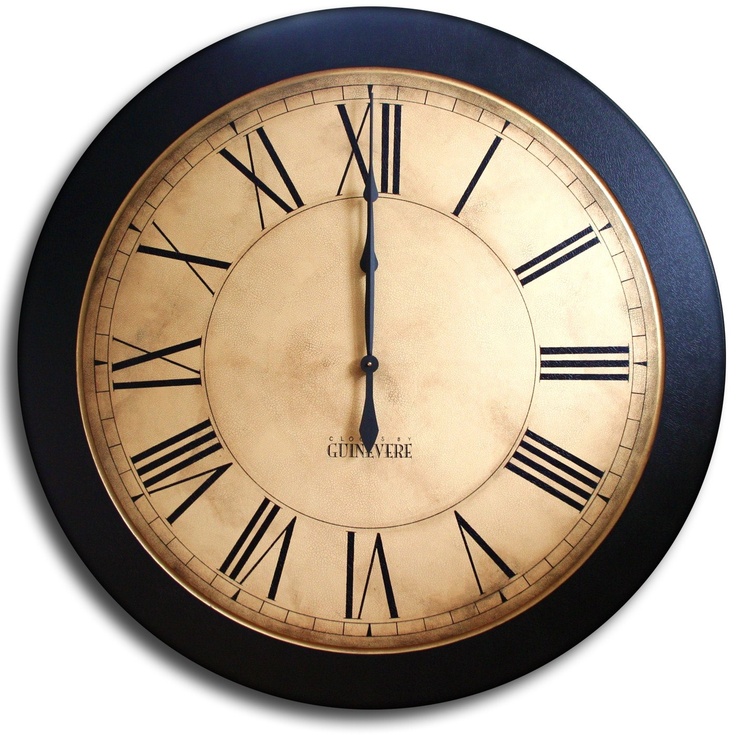
The width and height of the screenshot is (736, 735). Identify the location of clock face. (450, 353).